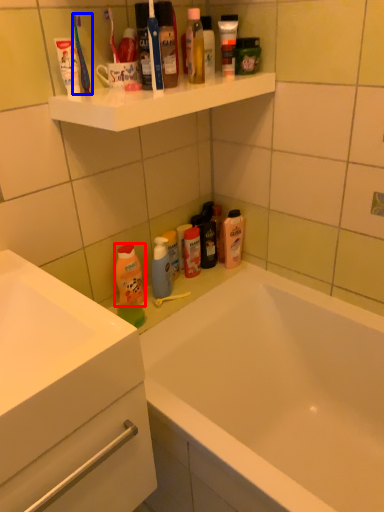
Question: Which object is closer to the camera taking this photo, cleaning product (highlighted by a red box) or toothbrush (highlighted by a blue box)?

Choices:
 (A) cleaning product
 (B) toothbrush

Answer: (B)